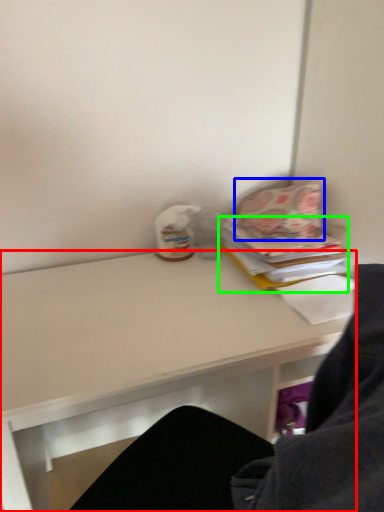
Question: Which object is the closest to the desk (highlighted by a red box)? Choose among these: pillow (highlighted by a blue box) or paperback book (highlighted by a green box).

Choices:
 (A) pillow
 (B) paperback book

Answer: (B)